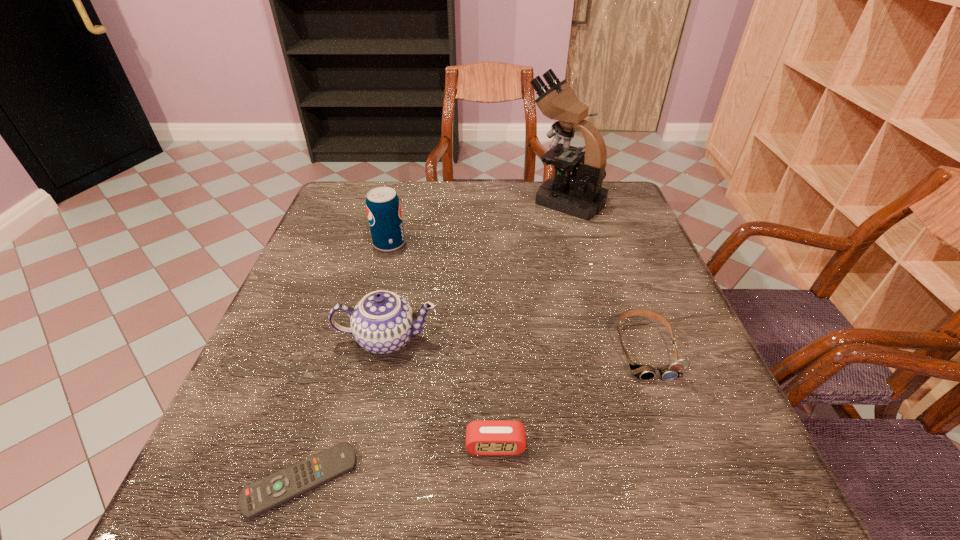
The image size is (960, 540). Identify the location of vacant space that satisfies the following two spatial constraints: 1. on the back side of the second farthest object; 2. on the left side of the shortest object. (373, 244).